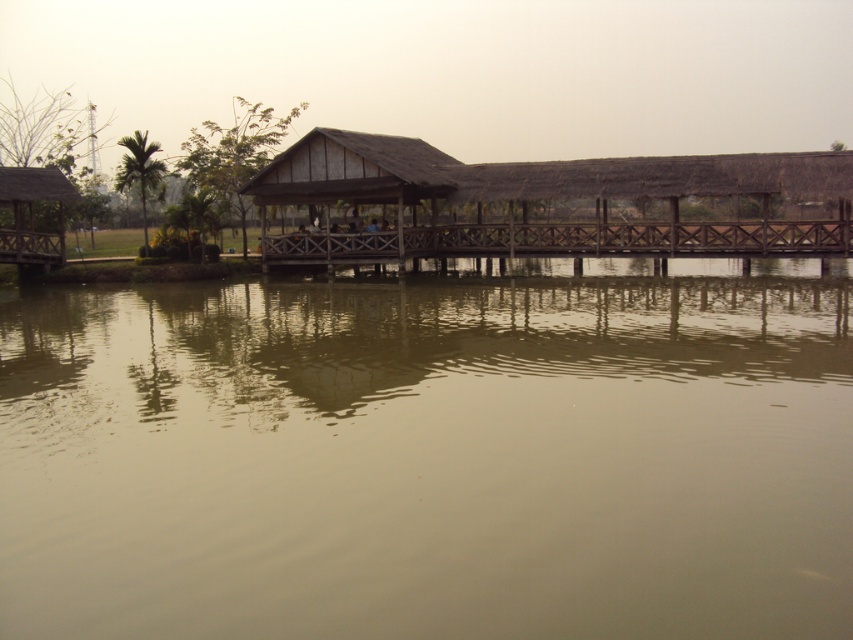
You are planning to place a 2.5 meter wide boat on the brown wooden dock at center. Given that the wooden hut at left is narrower than the dock, will the boat fit on the dock?

The brown wooden dock at center has a width larger than the wooden hut at left, so the dock is wide enough to accommodate the 2.5 meter wide boat.